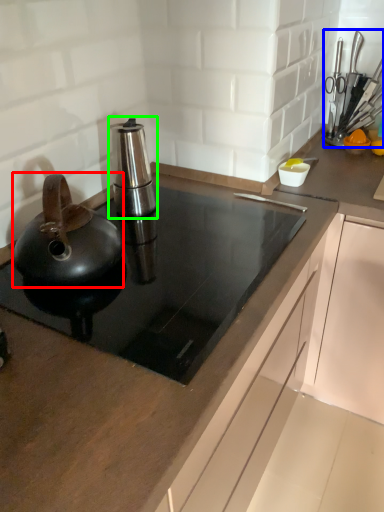
Question: Based on their relative distances, which object is farther from kitchen appliance (highlighted by a red box)? Choose from appliance (highlighted by a blue box) and kitchen appliance (highlighted by a green box).

Choices:
 (A) appliance
 (B) kitchen appliance

Answer: (A)